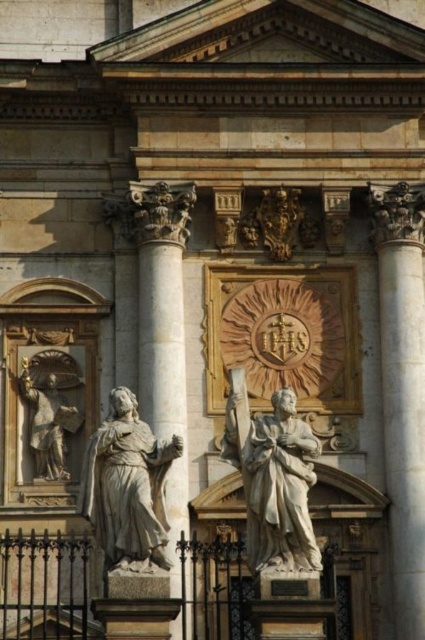
Who is positioned more to the left, white marble statue at center or matte gray statue at left?

matte gray statue at left

Between white marble statue at center and matte gray statue at left, which one has less height?

Standing shorter between the two is matte gray statue at left.

Describe the element at coordinates (274, 477) in the screenshot. I see `white marble statue at center` at that location.

Identify the location of white marble statue at center. Image resolution: width=425 pixels, height=640 pixels. (274, 477).

Is white marble column at right to the left of matte gray statue at left from the viewer's perspective?

In fact, white marble column at right is to the right of matte gray statue at left.

Is white marble column at right thinner than matte gray statue at left?

Incorrect, white marble column at right's width is not less than matte gray statue at left's.

Is point (414, 588) positioned after point (30, 381)?

No, it is not.

Where is `white marble column at right`? This screenshot has height=640, width=425. white marble column at right is located at coordinates (404, 422).

Does white marble statue at center have a lesser height compared to white marble column at center?

Correct, white marble statue at center is not as tall as white marble column at center.

Which is more to the right, white marble statue at center or white marble column at center?

white marble statue at center

Which is in front, point (309, 456) or point (178, 355)?

Point (309, 456)

Identify the location of white marble statue at center. (274, 477).